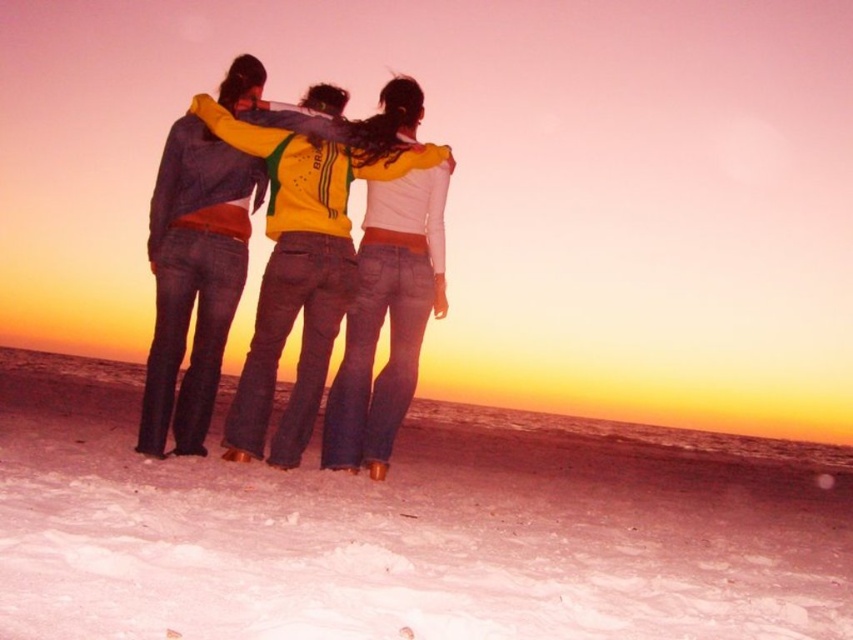
Based on the photo, you are planning to take a photo of the denim jacket at center and the white powdery snow at center. Which object will occupy more space in the photo?

The white powdery snow at center has a larger width than the denim jacket at center, so it will occupy more space in the photo.

You are a photographer trying to capture the perfect sunset shot. You notice a denim jacket at center in the image. Based on its 2D coordinates, where exactly is the denim jacket located in the frame?

The denim jacket at center is located at the 2D coordinates point (245, 260) in the frame.